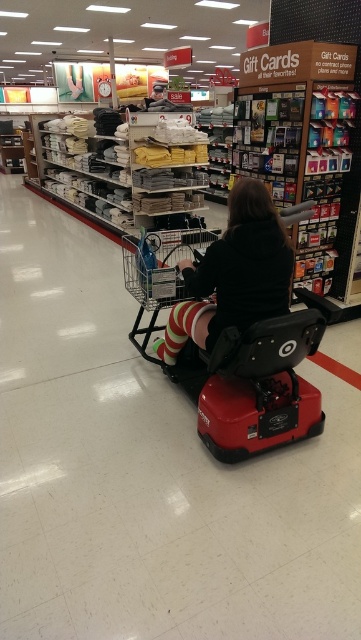
You are a store employee and you need to move the striped socks at center to the left side of the red plastic mobility scooter at center. Is this possible given their current positions?

The red plastic mobility scooter at center is currently positioned on the left side of the striped socks at center. Moving the striped socks at center to the left side of the scooter would require placing them to the scooter, which is already on the left. This might not be feasible without moving the scooter first, so it might not be possible unless the scooter is moved.

Consider the image. You are a store employee and need to move a tall display from the back of the store to the front. The path to the front requires navigating around the red plastic mobility scooter at center and the striped socks at center. Which object should you avoid hitting because it is taller?

The red plastic mobility scooter at center is much taller than the striped socks at center, so you should avoid hitting the red plastic mobility scooter at center to prevent damage to the display and the scooter.

You are a store employee and you need to retrieve an item from the basket of the red plastic mobility scooter at center. The striped socks at center are in your way. Can you move the socks to access the basket?

The red plastic mobility scooter at center is closer to the viewer than the striped socks at center, so you can move the striped socks at center out of the way to access the basket.